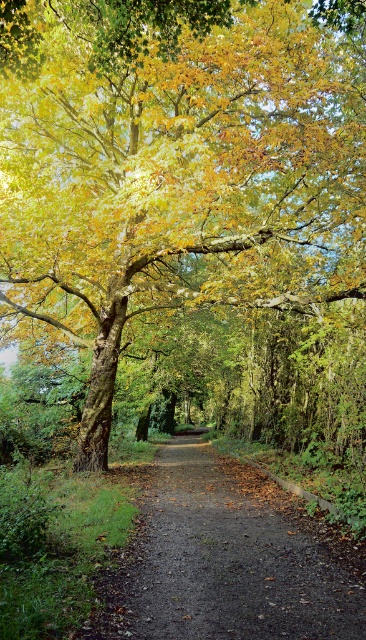
Question: Does golden leafy tree at center appear on the right side of dirt path at center?

Choices:
 (A) yes
 (B) no

Answer: (B)

Question: Which object is closer to the camera taking this photo?

Choices:
 (A) dirt path at center
 (B) golden leafy tree at center

Answer: (A)

Question: In this image, where is golden leafy tree at center located relative to dirt path at center?

Choices:
 (A) left
 (B) right

Answer: (A)

Question: Does golden leafy tree at center appear on the right side of dirt path at center?

Choices:
 (A) no
 (B) yes

Answer: (A)

Question: Which object appears farthest from the camera in this image?

Choices:
 (A) golden leafy tree at center
 (B) dirt path at center

Answer: (A)

Question: Among these objects, which one is farthest from the camera?

Choices:
 (A) golden leafy tree at center
 (B) dirt path at center

Answer: (A)